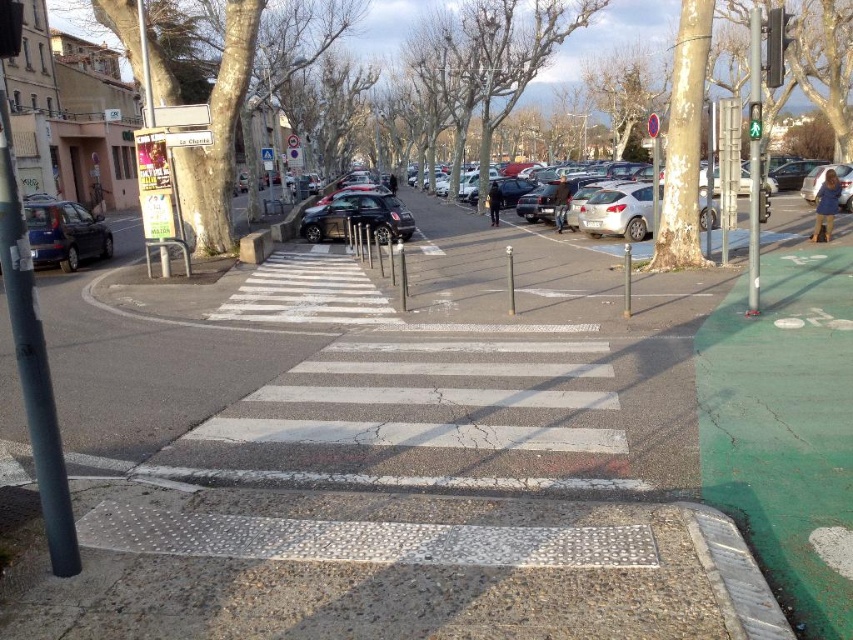
You are a delivery driver who needs to park your silver metallic sedan at center in a designated parking zone. According to the scene description, where should you position your vehicle?

The green painted area to the right of the pedestrian crossing is the designated parking zone, so you should position your silver metallic sedan at center there.

You are a pedestrian waiting at the crosswalk. You see a matte black car at left and a green glass pedestrian signal at upper center. Which object is closer to the ground?

The matte black car at left is closer to the ground because it is positioned below the green glass pedestrian signal at upper center.